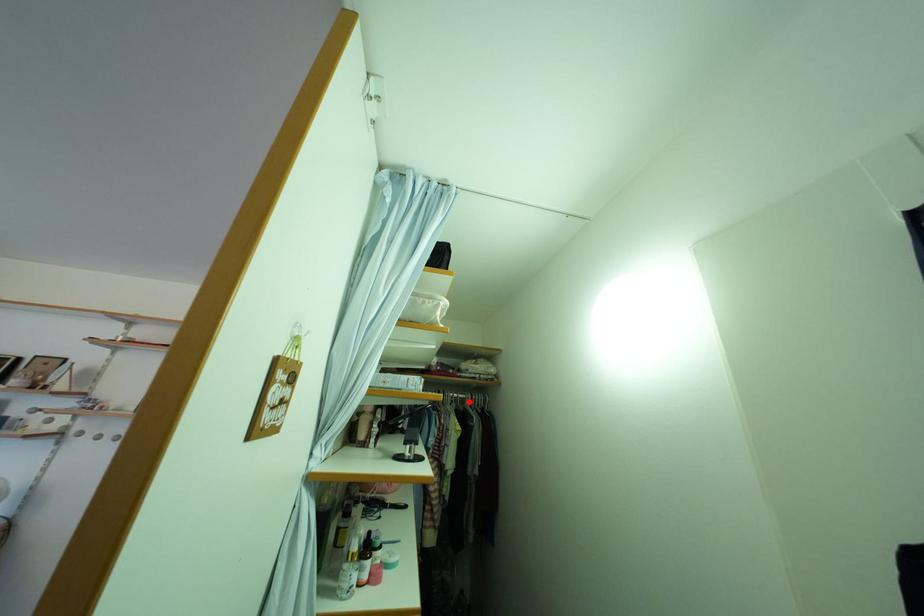
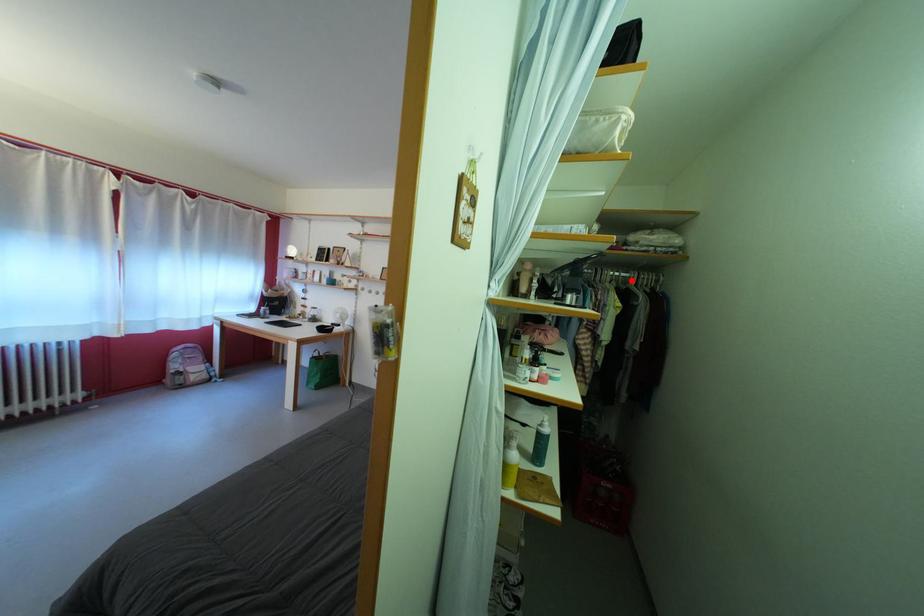
I am providing you with two images of the same scene from different viewpoints. A red point is marked on the first image and another point is marked on the second image. Do the highlighted points in image1 and image2 indicate the same real-world spot?

Yes